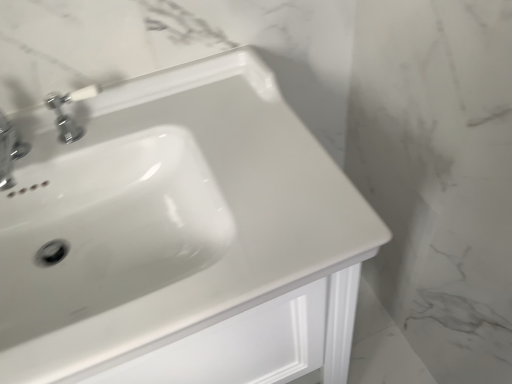
Question: From a real-world perspective, is white glossy sink at center on top of chrome metallic faucet at upper left, which is the 1th tap from left to right?

Choices:
 (A) yes
 (B) no

Answer: (B)

Question: Is white glossy sink at center outside chrome metallic faucet at upper left, which is the 1th tap from left to right?

Choices:
 (A) yes
 (B) no

Answer: (A)

Question: Considering the relative sizes of white glossy sink at center and chrome metallic faucet at upper left, placed as the second tap when sorted from right to left, in the image provided, is white glossy sink at center smaller than chrome metallic faucet at upper left, placed as the second tap when sorted from right to left,?

Choices:
 (A) yes
 (B) no

Answer: (B)

Question: Considering the relative sizes of white glossy sink at center and chrome metallic faucet at upper left, placed as the second tap when sorted from right to left, in the image provided, is white glossy sink at center shorter than chrome metallic faucet at upper left, placed as the second tap when sorted from right to left,?

Choices:
 (A) no
 (B) yes

Answer: (A)

Question: Is white glossy sink at center next to chrome metallic faucet at upper left, which is the 1th tap from left to right?

Choices:
 (A) yes
 (B) no

Answer: (B)

Question: In terms of width, does chrome metallic faucet at upper left, the first tap when ordered from right to left, look wider or thinner when compared to white glossy sink at center?

Choices:
 (A) thin
 (B) wide

Answer: (A)

Question: Considering the positions of chrome metallic faucet at upper left, which is the second tap in left-to-right order, and white glossy sink at center in the image, is chrome metallic faucet at upper left, which is the second tap in left-to-right order, bigger or smaller than white glossy sink at center?

Choices:
 (A) small
 (B) big

Answer: (A)

Question: Is chrome metallic faucet at upper left, which is the second tap in left-to-right order, inside or outside of white glossy sink at center?

Choices:
 (A) outside
 (B) inside

Answer: (B)

Question: From the image's perspective, relative to white glossy sink at center, is chrome metallic faucet at upper left, which is the second tap in left-to-right order, above or below?

Choices:
 (A) below
 (B) above

Answer: (B)

Question: Considering the positions of point (298, 165) and point (87, 92), is point (298, 165) closer or farther from the camera than point (87, 92)?

Choices:
 (A) farther
 (B) closer

Answer: (B)

Question: Looking at the image, does white glossy sink at center seem bigger or smaller compared to chrome metallic faucet at upper left, which is the second tap in left-to-right order?

Choices:
 (A) small
 (B) big

Answer: (B)

Question: Is white glossy sink at center spatially inside chrome metallic faucet at upper left, the first tap when ordered from right to left, or outside of it?

Choices:
 (A) outside
 (B) inside

Answer: (A)

Question: Considering the positions of white glossy sink at center and chrome metallic faucet at upper left, the first tap when ordered from right to left, in the image, is white glossy sink at center wider or thinner than chrome metallic faucet at upper left, the first tap when ordered from right to left,?

Choices:
 (A) wide
 (B) thin

Answer: (A)

Question: Based on their sizes in the image, would you say white glossy sink at center is bigger or smaller than chrome metallic faucet at upper left, which is the 1th tap from left to right?

Choices:
 (A) small
 (B) big

Answer: (B)

Question: Is white glossy sink at center spatially inside chrome metallic faucet at upper left, which is the 1th tap from left to right, or outside of it?

Choices:
 (A) outside
 (B) inside

Answer: (A)